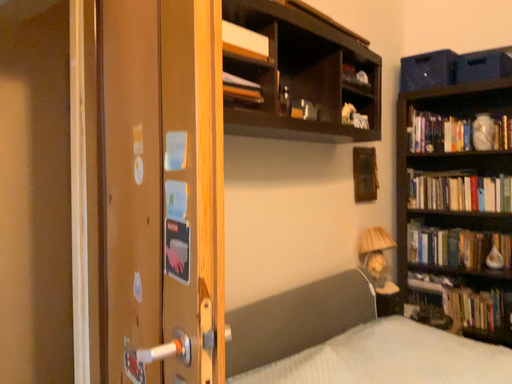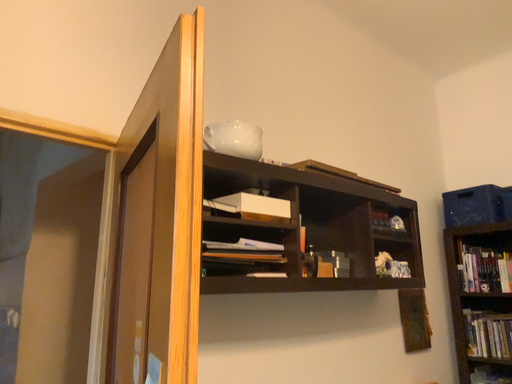
Question: How did the camera likely rotate when shooting the video?

Choices:
 (A) rotated right
 (B) rotated left

Answer: (B)